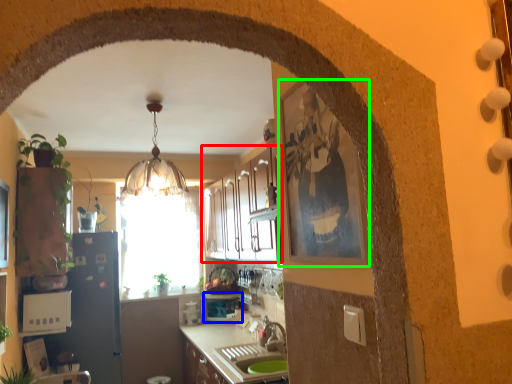
Question: Considering the real-world distances, which object is farthest from cabinetry (highlighted by a red box)? appliance (highlighted by a blue box) or picture frame (highlighted by a green box)?

Choices:
 (A) appliance
 (B) picture frame

Answer: (B)